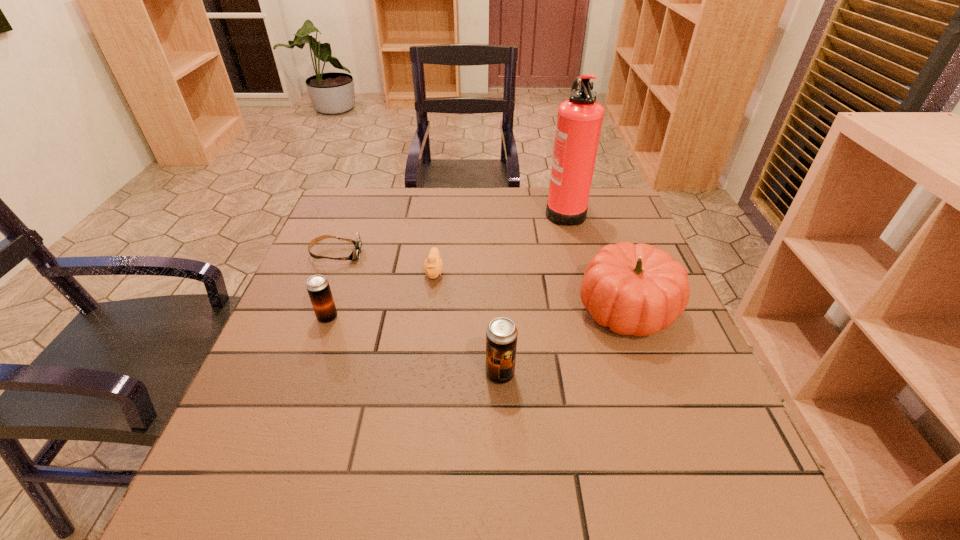
What are the coordinates of `goggles located at the left edge` in the screenshot? It's located at (355, 254).

I want to click on fire extinguisher located at the right edge, so (x=579, y=121).

At what (x,y) coordinates should I click in order to perform the action: click on pumpkin at the right edge. Please return your answer as a coordinate pair (x, y). Image resolution: width=960 pixels, height=540 pixels. Looking at the image, I should click on (634, 289).

This screenshot has width=960, height=540. Identify the location of object that is positioned at the far right corner. (579, 121).

Locate an element on the screen. This screenshot has width=960, height=540. vacant space at the far edge is located at coordinates (420, 207).

Find the location of a particular element. The width and height of the screenshot is (960, 540). blank space at the near edge of the desktop is located at coordinates (599, 420).

The height and width of the screenshot is (540, 960). I want to click on vacant space at the left edge of the desktop, so click(323, 272).

In the image, there is a desktop. In order to click on free space at the far left corner in this screenshot , I will do `click(356, 188)`.

You are a GUI agent. You are given a task and a screenshot of the screen. Output one action in this format:
    pyautogui.click(x=<x>, y=<y>)
    Task: Click on the free space between the second shortest object and the nearer beer can
    The width and height of the screenshot is (960, 540).
    Given the screenshot: What is the action you would take?
    coord(468,323)

Find the location of `free space between the farther beer can and the duckling`. free space between the farther beer can and the duckling is located at coordinates (381, 294).